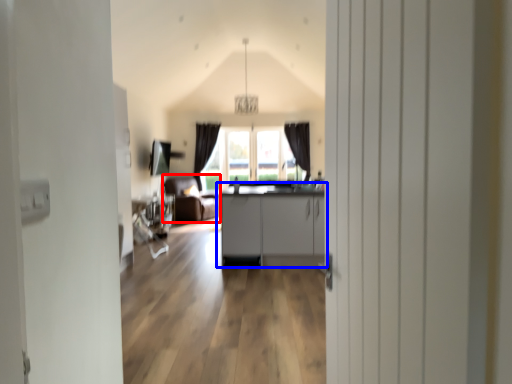
Question: Which point is closer to the camera, armchair (highlighted by a red box) or cabinetry (highlighted by a blue box)?

Choices:
 (A) armchair
 (B) cabinetry

Answer: (B)